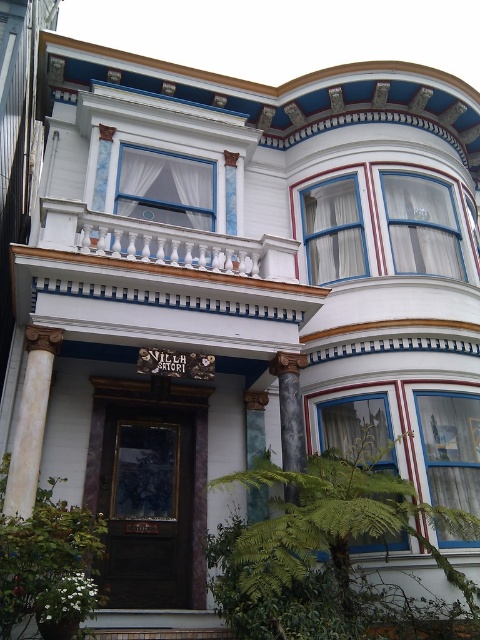
You are a delivery person standing at the front door of Villa Satori. You need to place a package on the ground between the matte white window at upper right and the white fabric curtain at upper center. Is there enough space to place the package?

The distance between the matte white window at upper right and the white fabric curtain at upper center is 3.51 meters, so yes, there is enough space to place the package between them.

You are a delivery person trying to place a package on the porch of the Victorian house. The package is 10 inches wide. You see the matte white bay window at upper right and the matte white window at upper right. Can you fit the package between them?

The matte white bay window at upper right and the matte white window at upper right are 9.36 inches apart from each other. Since the package is 10 inches wide, it cannot fit between them.